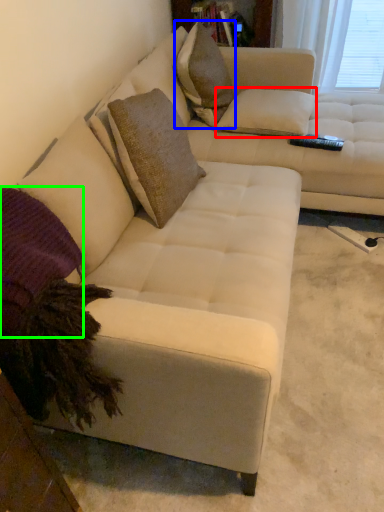
Question: Estimate the real-world distances between objects in this image. Which object is farther from pillow (highlighted by a red box), throw pillow (highlighted by a blue box) or pillow (highlighted by a green box)?

Choices:
 (A) throw pillow
 (B) pillow

Answer: (B)